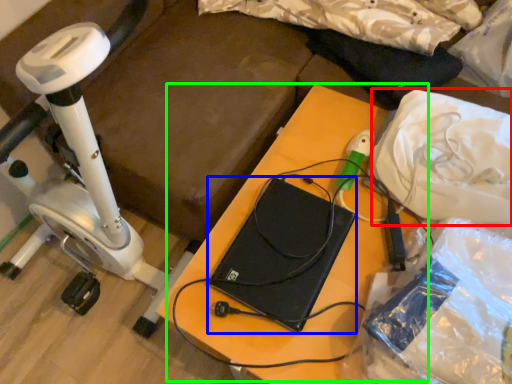
Question: Which is farther away from material (highlighted by a red box)? computer (highlighted by a blue box) or table (highlighted by a green box)?

Choices:
 (A) computer
 (B) table

Answer: (A)